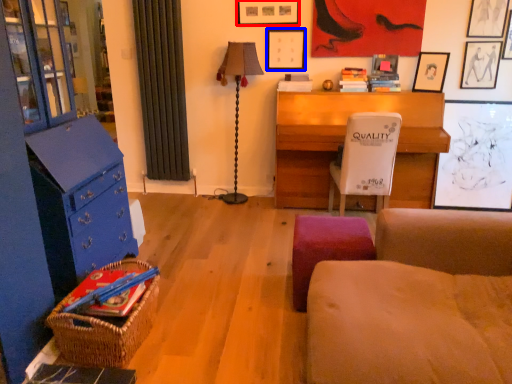
Question: Which object is further to the camera taking this photo, picture frame (highlighted by a red box) or picture frame (highlighted by a blue box)?

Choices:
 (A) picture frame
 (B) picture frame

Answer: (B)